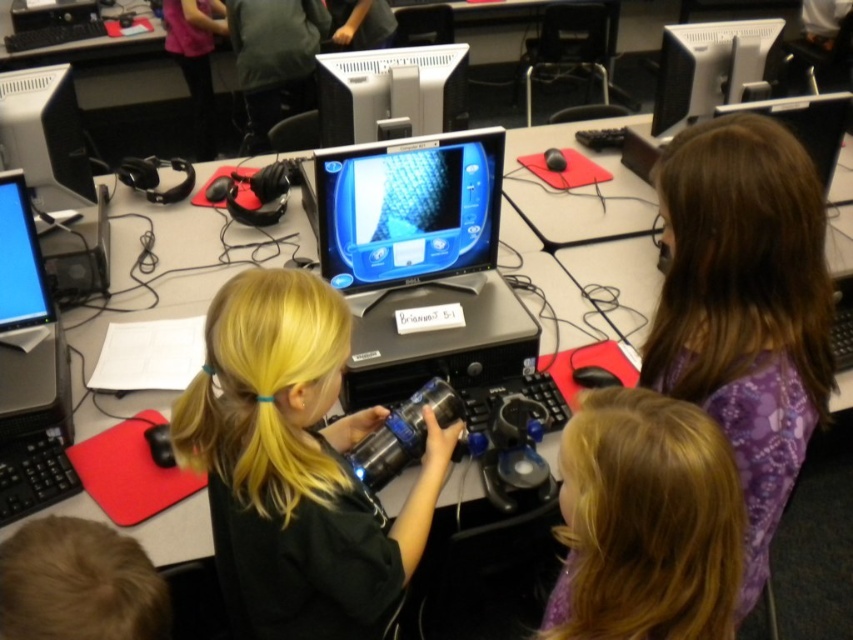
You are a student in the classroom and need to locate the shiny black monitor at center. Based on the coordinates provided, where should you look relative to the desk?

The shiny black monitor at center is located at coordinates point (407, 212), which means it is positioned one third from the left and nearly halfway up the desk.

In the classroom scene, where exactly is the blonde hair at center located in terms of coordinates?

The blonde hair at center is located at coordinates point (x=646, y=522).

You are a teacher standing at the front of the classroom. You notice a student struggling to reach the keyboard located at point (730, 497). If your arm can extend 60 centimeters, can you reach the keyboard from your current position?

The distance between point (730, 497) and the camera is 75.80 centimeters. Since your arm can only extend 60 centimeters, you cannot reach the keyboard at point (730, 497) from your current position.